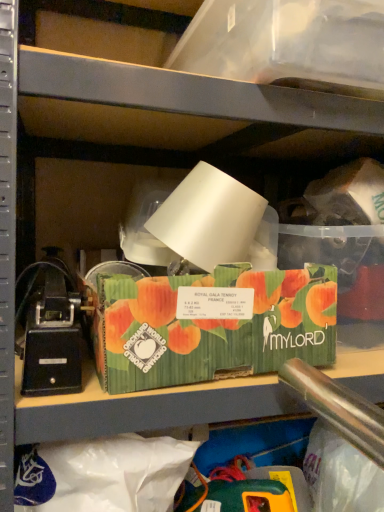
Question: Is the position of transparent plastic storage box at upper center, the 2th storage box in the bottom-to-top sequence, less distant than that of green corrugated cardboard box at center, arranged as the 1th storage box when ordered from the bottom?

Choices:
 (A) yes
 (B) no

Answer: (A)

Question: Can you confirm if transparent plastic storage box at upper center, the 2th storage box in the bottom-to-top sequence, is smaller than green corrugated cardboard box at center, the second storage box from the top?

Choices:
 (A) no
 (B) yes

Answer: (A)

Question: From the image's perspective, is transparent plastic storage box at upper center, the 1th storage box in the top-to-bottom sequence, on green corrugated cardboard box at center, arranged as the 1th storage box when ordered from the bottom?

Choices:
 (A) yes
 (B) no

Answer: (A)

Question: Is transparent plastic storage box at upper center, the 1th storage box in the top-to-bottom sequence, oriented towards green corrugated cardboard box at center, arranged as the 1th storage box when ordered from the bottom?

Choices:
 (A) yes
 (B) no

Answer: (B)

Question: From a real-world perspective, is transparent plastic storage box at upper center, the 2th storage box in the bottom-to-top sequence, under green corrugated cardboard box at center, arranged as the 1th storage box when ordered from the bottom?

Choices:
 (A) yes
 (B) no

Answer: (B)

Question: From a real-world perspective, is green corrugated cardboard box at center, the second storage box from the top, positioned above or below transparent plastic storage box at upper center, the 1th storage box in the top-to-bottom sequence?

Choices:
 (A) above
 (B) below

Answer: (B)

Question: Is green corrugated cardboard box at center, arranged as the 1th storage box when ordered from the bottom, bigger or smaller than transparent plastic storage box at upper center, the 1th storage box in the top-to-bottom sequence?

Choices:
 (A) big
 (B) small

Answer: (B)

Question: Considering their positions, is green corrugated cardboard box at center, arranged as the 1th storage box when ordered from the bottom, located in front of or behind transparent plastic storage box at upper center, the 2th storage box in the bottom-to-top sequence?

Choices:
 (A) front
 (B) behind

Answer: (B)

Question: From the image's perspective, is green corrugated cardboard box at center, arranged as the 1th storage box when ordered from the bottom, positioned above or below transparent plastic storage box at upper center, the 2th storage box in the bottom-to-top sequence?

Choices:
 (A) below
 (B) above

Answer: (A)

Question: From the image's perspective, relative to green corrugated cardboard box at center, arranged as the 1th storage box when ordered from the bottom, is black plastic toy at left above or below?

Choices:
 (A) above
 (B) below

Answer: (B)

Question: Considering their positions, is black plastic toy at left located in front of or behind green corrugated cardboard box at center, arranged as the 1th storage box when ordered from the bottom?

Choices:
 (A) behind
 (B) front

Answer: (B)

Question: Does point (34, 321) appear closer or farther from the camera than point (321, 332)?

Choices:
 (A) closer
 (B) farther

Answer: (A)

Question: Considering the positions of black plastic toy at left and green corrugated cardboard box at center, the second storage box from the top, in the image, is black plastic toy at left wider or thinner than green corrugated cardboard box at center, the second storage box from the top,?

Choices:
 (A) wide
 (B) thin

Answer: (A)

Question: Would you say transparent plastic storage box at upper center, the 2th storage box in the bottom-to-top sequence, is inside or outside green corrugated cardboard box at center, arranged as the 1th storage box when ordered from the bottom?

Choices:
 (A) inside
 (B) outside

Answer: (B)

Question: Based on their sizes in the image, would you say transparent plastic storage box at upper center, the 2th storage box in the bottom-to-top sequence, is bigger or smaller than green corrugated cardboard box at center, arranged as the 1th storage box when ordered from the bottom?

Choices:
 (A) big
 (B) small

Answer: (A)